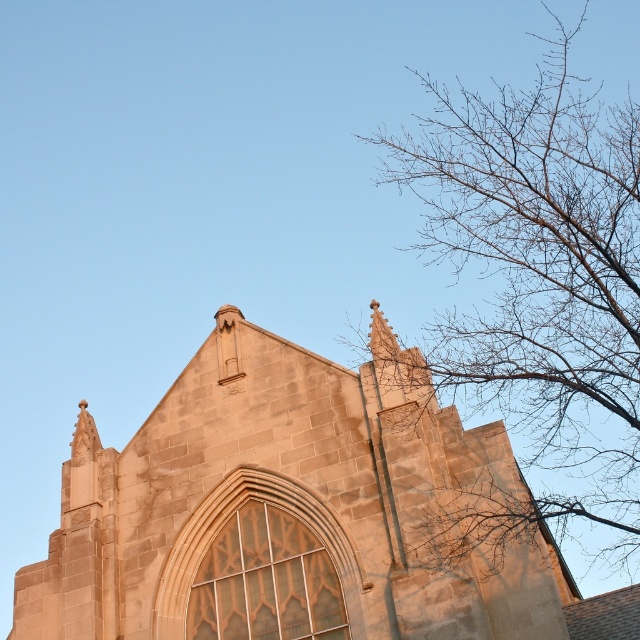
Question: Does stone church at center appear under bare branches at upper right?

Choices:
 (A) no
 (B) yes

Answer: (B)

Question: Can you confirm if stone church at center is positioned to the left of bare branches at upper right?

Choices:
 (A) no
 (B) yes

Answer: (B)

Question: Which object is closer to the camera taking this photo?

Choices:
 (A) bare branches at upper right
 (B) stone church at center

Answer: (B)

Question: Is stone church at center bigger than bare branches at upper right?

Choices:
 (A) yes
 (B) no

Answer: (B)